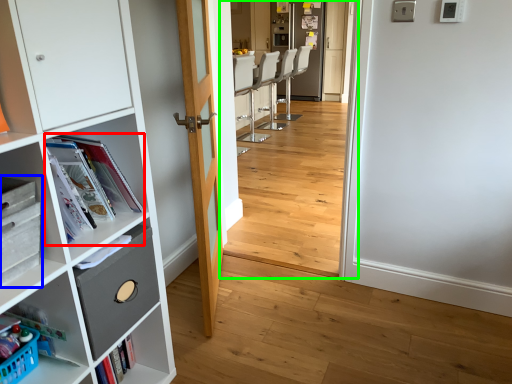
Question: Based on their relative distances, which object is nearer to magazine (highlighted by a red box)? Choose from cabinetry (highlighted by a blue box) and corridor (highlighted by a green box).

Choices:
 (A) cabinetry
 (B) corridor

Answer: (A)